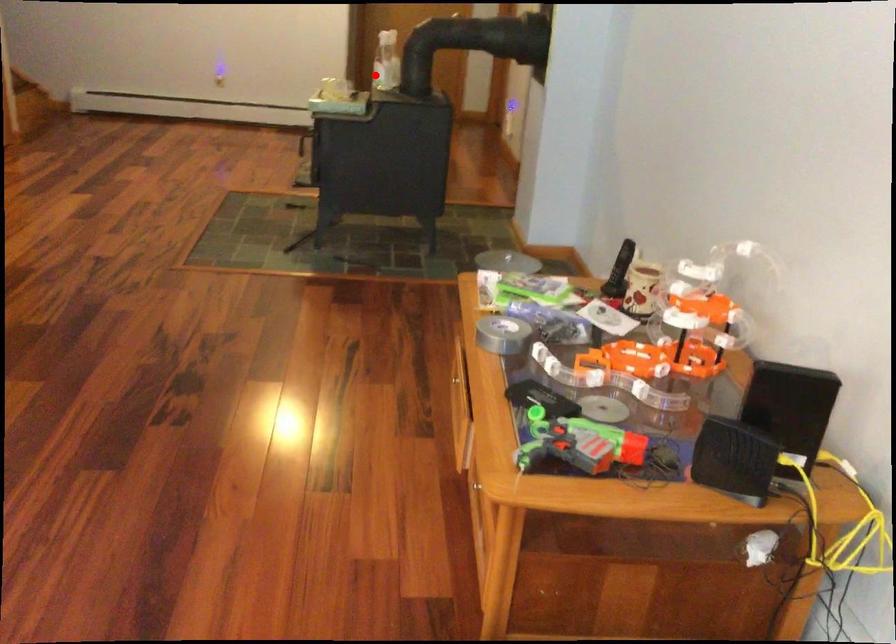
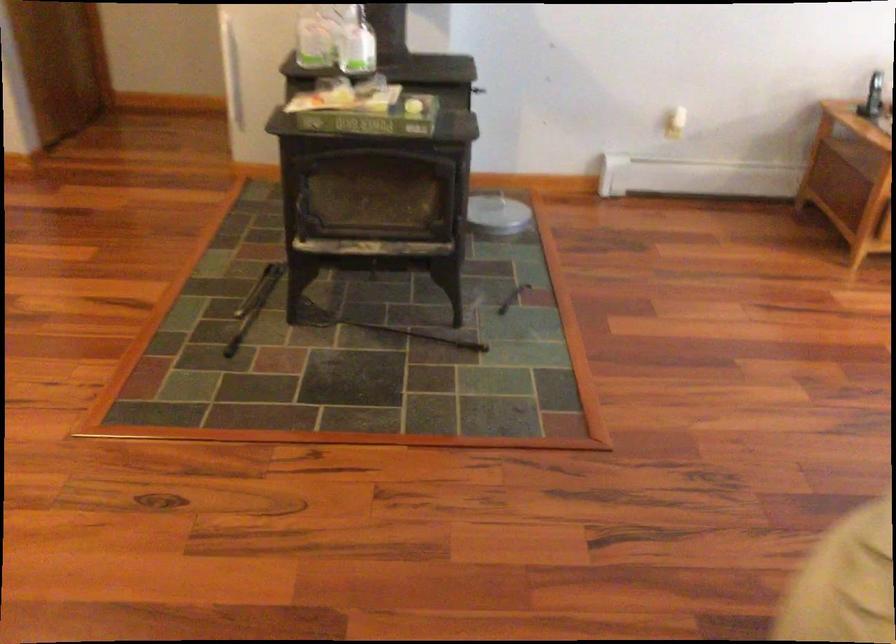
Question: I am providing you with two images of the same scene from different viewpoints. Given a red point in image1, look at the same physical point in image2. Is it:

Choices:
 (A) Closer to the viewpoint
 (B) Farther from the viewpoint

Answer: (A)